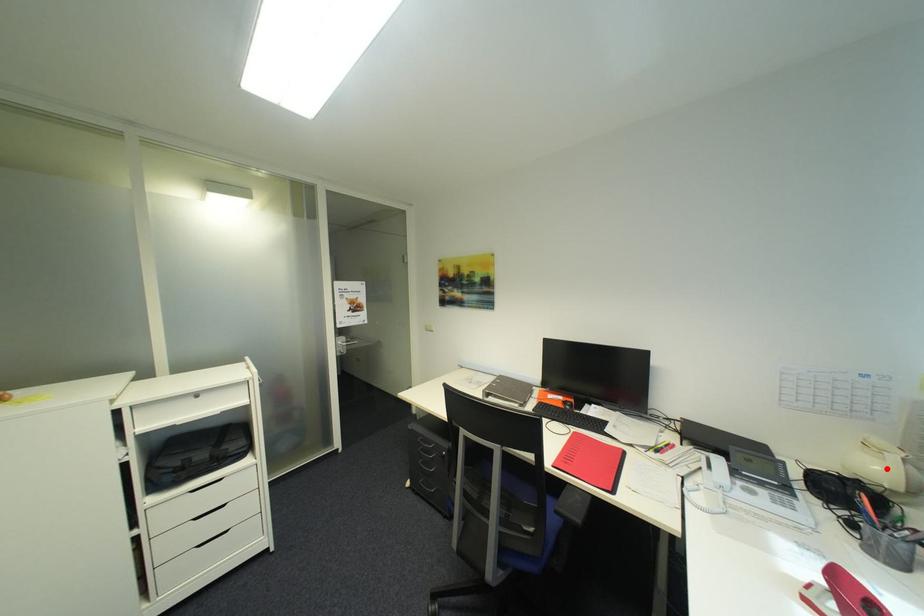
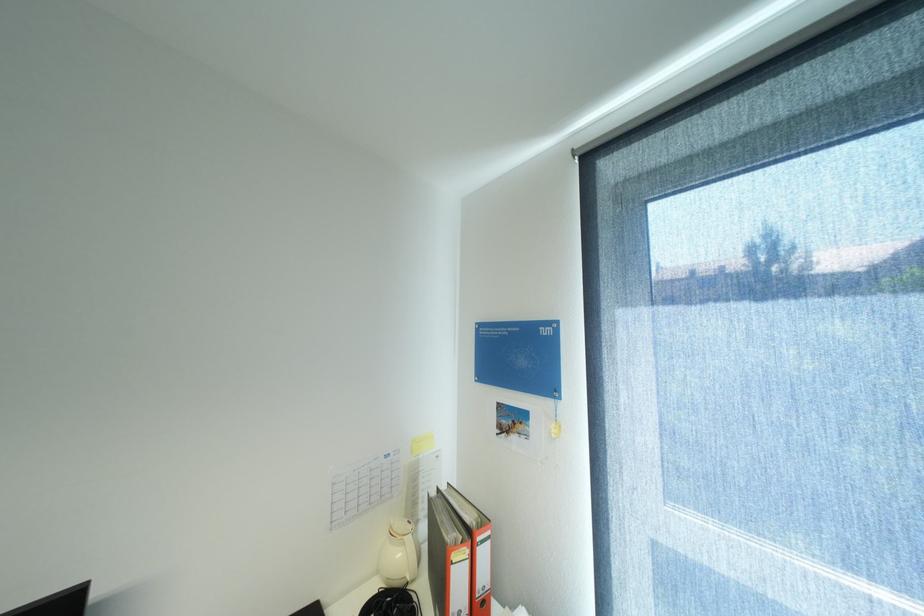
The point at the highlighted location is marked in the first image. Where is the corresponding point in the second image?

(407, 554)